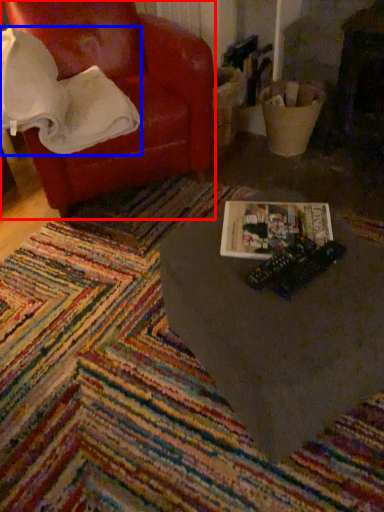
Question: Which of the following is the farthest to the observer, chair (highlighted by a red box) or blanket (highlighted by a blue box)?

Choices:
 (A) chair
 (B) blanket

Answer: (A)